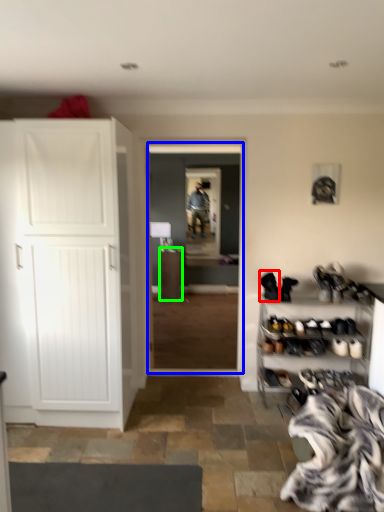
Question: Based on their relative distances, which object is nearer to footwear (highlighted by a red box)? Choose from corridor (highlighted by a blue box) and cabinetry (highlighted by a green box).

Choices:
 (A) corridor
 (B) cabinetry

Answer: (B)